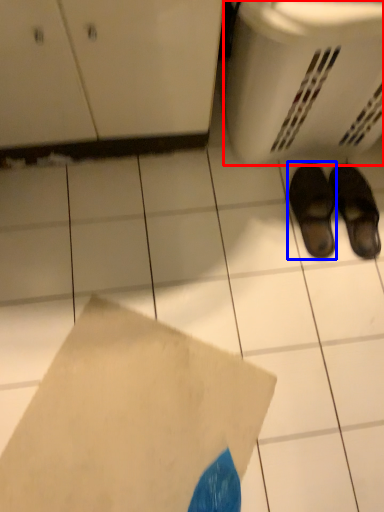
Question: Which object appears closest to the camera in this image, basket (highlighted by a red box) or footwear (highlighted by a blue box)?

Choices:
 (A) basket
 (B) footwear

Answer: (A)